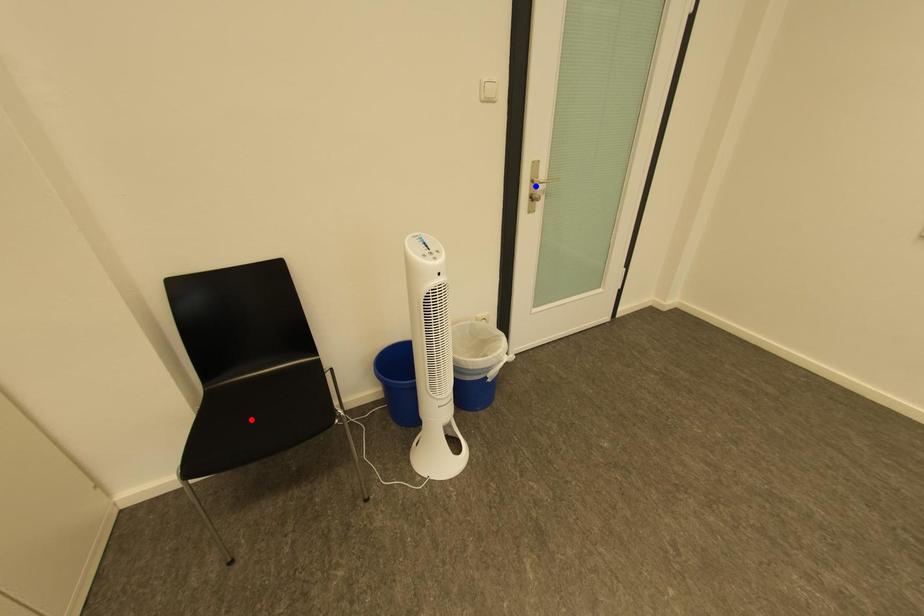
Question: Which of the two points in the image is closer to the camera?

Choices:
 (A) Blue point is closer.
 (B) Red point is closer.

Answer: (B)